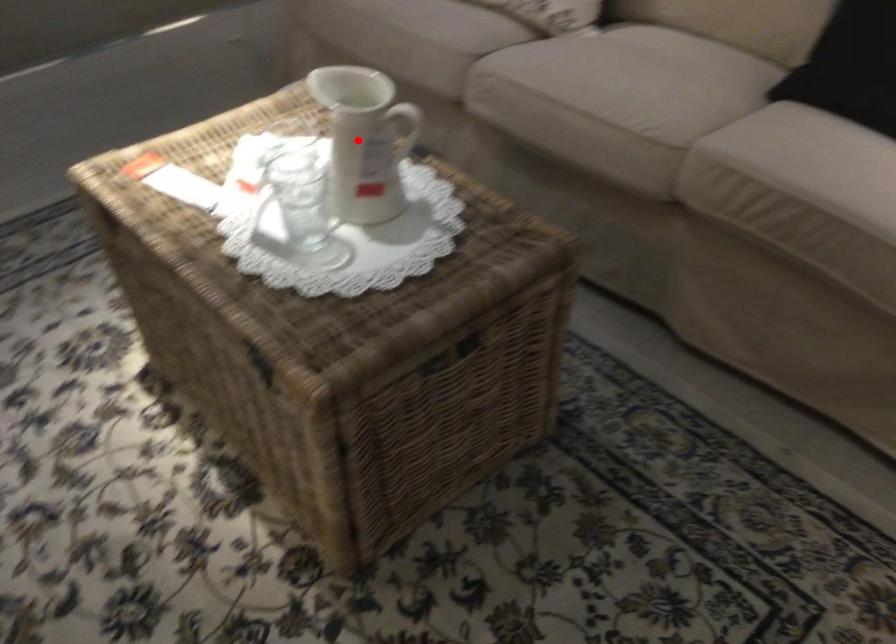
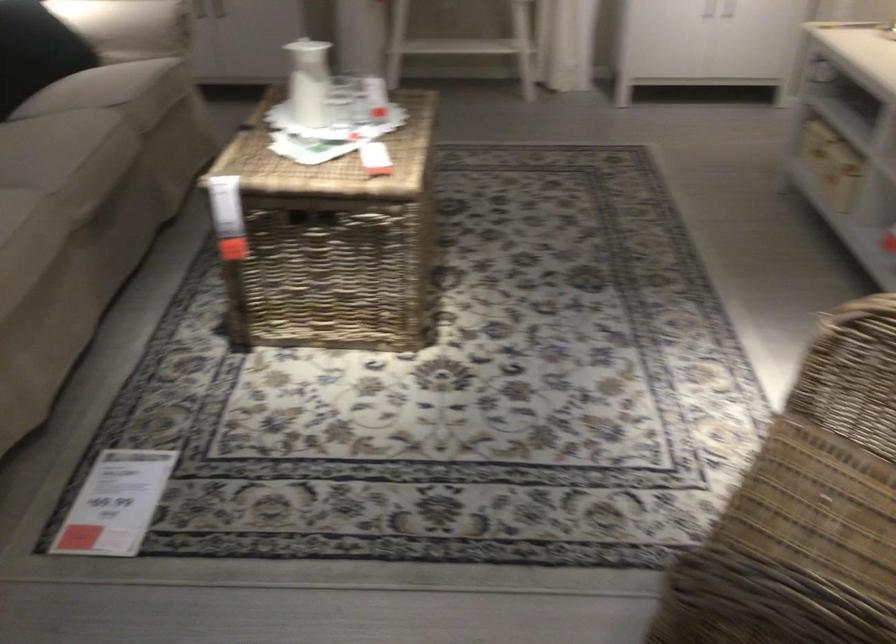
Where in the second image is the point corresponding to the highlighted location from the first image?

(308, 82)